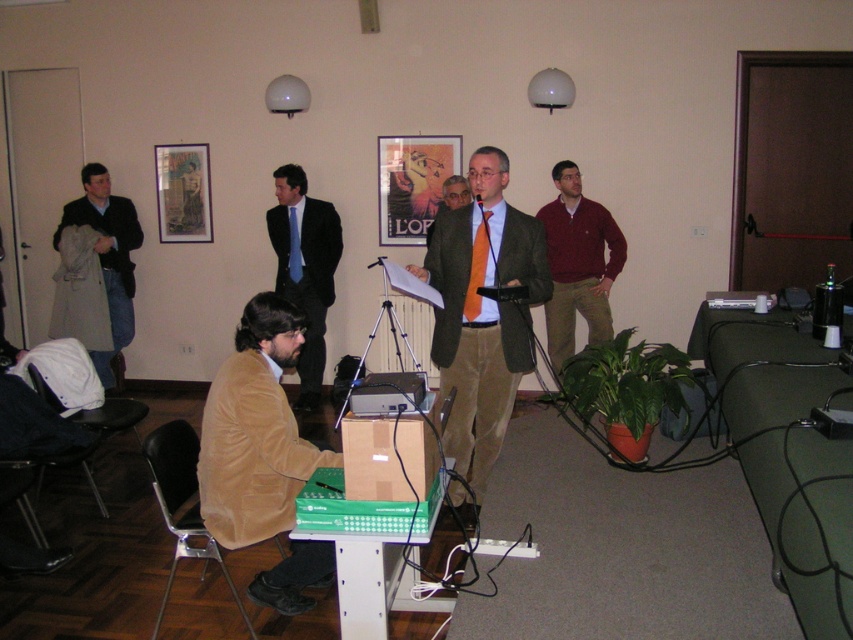
Question: Can you confirm if suede jacket at lower left is positioned to the left of matte brown suit at center?

Choices:
 (A) no
 (B) yes

Answer: (B)

Question: Among these points, which one is farthest from the camera?

Choices:
 (A) (277, 304)
 (B) (107, 236)
 (C) (392, 442)
 (D) (463, 193)

Answer: (B)

Question: Which is farther from the dark blue denim jeans at left?

Choices:
 (A) matte green suit at center
 (B) matte brown suit at center
 (C) brown cardboard box at center
 (D) maroon sweater at center

Answer: (C)

Question: Does maroon sweater at center appear on the left side of brown cardboard box at center?

Choices:
 (A) yes
 (B) no

Answer: (B)

Question: Which point is closer to the camera?

Choices:
 (A) matte green suit at center
 (B) maroon sweater at center

Answer: (A)

Question: Does suede jacket at lower left appear over dark blue denim jeans at left?

Choices:
 (A) yes
 (B) no

Answer: (B)